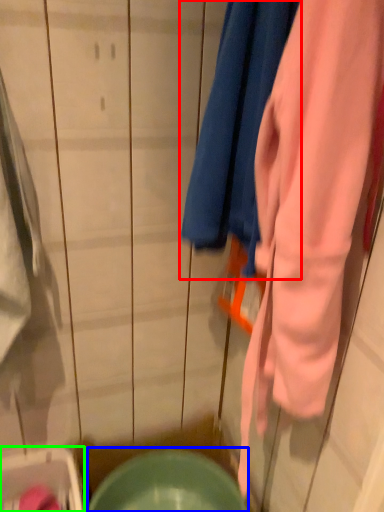
Question: Which is farther away from towel (highlighted by a red box)? mixing bowl (highlighted by a blue box) or washer (highlighted by a green box)?

Choices:
 (A) mixing bowl
 (B) washer

Answer: (B)